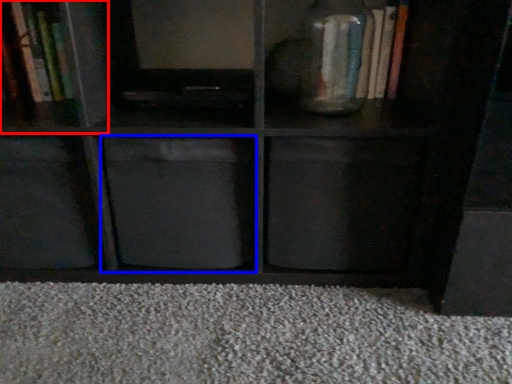
Question: Which object is further to the camera taking this photo, cabinet (highlighted by a red box) or cabinet (highlighted by a blue box)?

Choices:
 (A) cabinet
 (B) cabinet

Answer: (A)